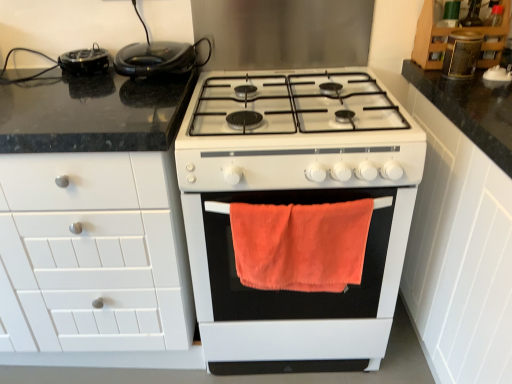
Question: From a real-world perspective, is orange fuzzy towel at center physically located above or below matte brown jar at upper right, the third appliance from the left?

Choices:
 (A) above
 (B) below

Answer: (B)

Question: Do you think orange fuzzy towel at center is within matte brown jar at upper right, which ranks as the 1th appliance in right-to-left order, or outside of it?

Choices:
 (A) outside
 (B) inside

Answer: (A)

Question: Considering the real-world distances, which object is closest to the orange fuzzy towel at center?

Choices:
 (A) black glossy waffle maker at upper left, the 1th appliance when ordered from top to bottom
 (B) white matte cabinet at left, which is counted as the third cabinetry, starting from the right
 (C) white matte cabinet at right, which ranks as the first cabinetry in right-to-left order
 (D) wooden cabinet at upper right, the second cabinetry viewed from the left
 (E) black rubberized toaster at upper left

Answer: (B)

Question: Which of these objects is positioned closest to the orange fuzzy towel at center?

Choices:
 (A) wooden cabinet at upper right, the second cabinetry viewed from the left
 (B) white matte cabinet at right, the 3th cabinetry in the left-to-right sequence
 (C) black rubberized toaster at upper left
 (D) white matte cabinet at left, which is counted as the third cabinetry, starting from the right
 (E) matte brown jar at upper right, the third appliance from the left

Answer: (D)